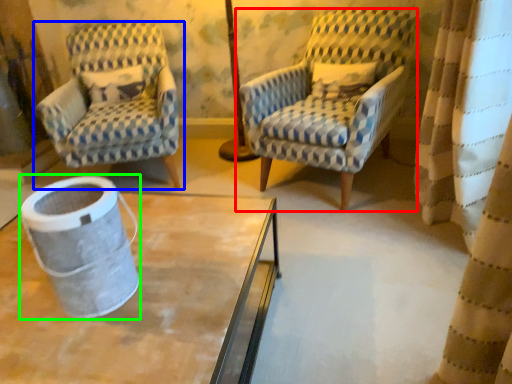
Question: Which is nearer to the chair (highlighted by a red box)? chair (highlighted by a blue box) or gray (highlighted by a green box).

Choices:
 (A) chair
 (B) gray

Answer: (A)